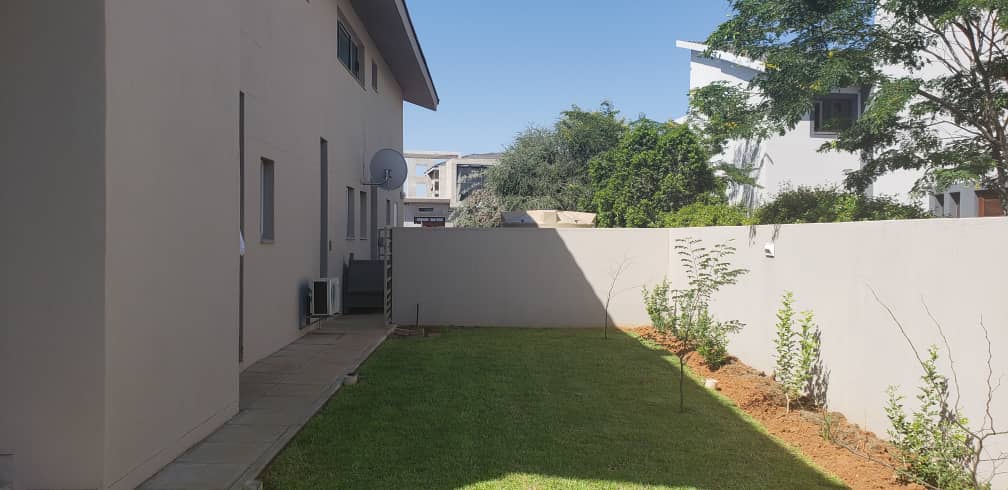
At what (x,y) coordinates should I click in order to perform the action: click on stairs. Please return your answer as a coordinate pair (x, y). This screenshot has width=1008, height=490. Looking at the image, I should click on (355, 272).